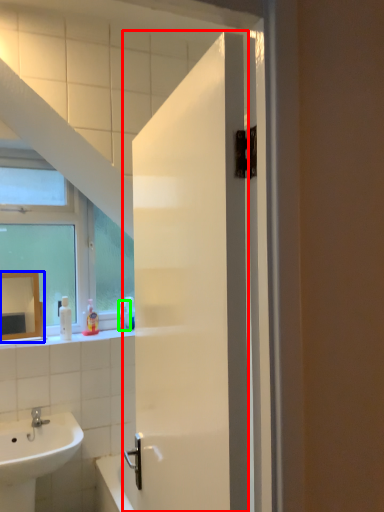
Question: Which object is the closest to the door (highlighted by a red box)? Choose among these: mirror (highlighted by a blue box) or toiletry (highlighted by a green box).

Choices:
 (A) mirror
 (B) toiletry

Answer: (A)